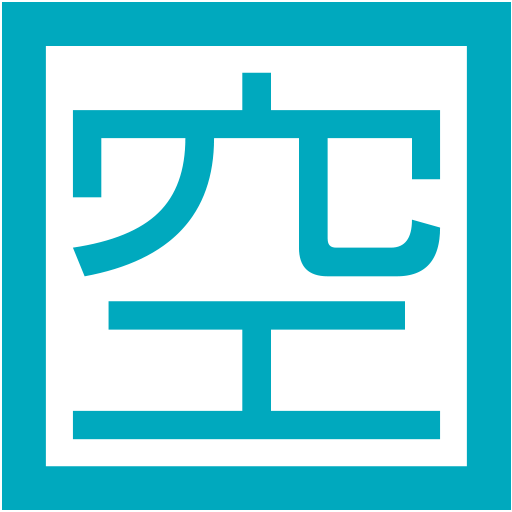
Identify the location of interior. (249, 287).